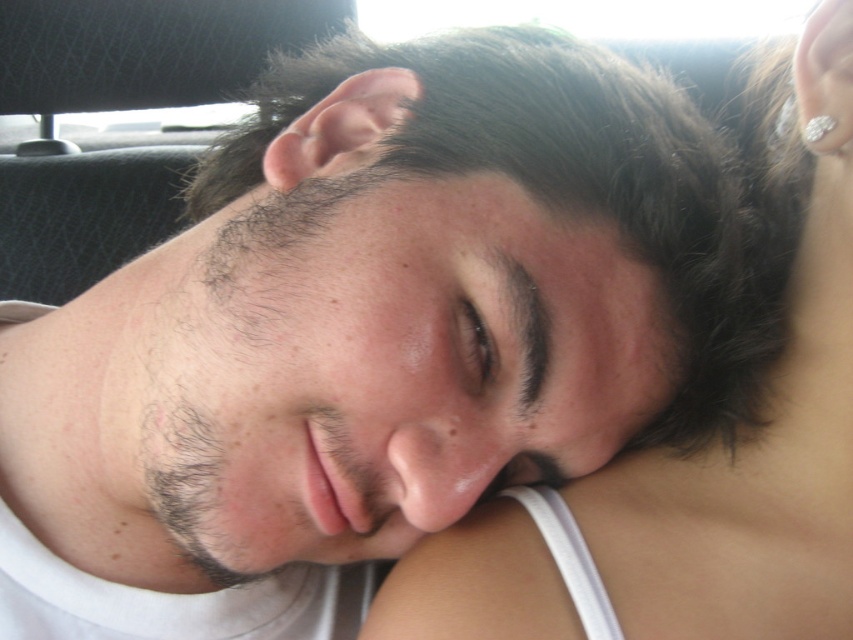
Question: Which of the following is the farthest from the observer?

Choices:
 (A) dark brown hair at center
 (B) white fabric at upper center
 (C) brown matte eye at center

Answer: (B)

Question: Which point is closer to the camera taking this photo?

Choices:
 (A) (x=469, y=308)
 (B) (x=251, y=208)
 (C) (x=376, y=611)

Answer: (A)

Question: Considering the relative positions of dark brown hair at center and white fabric at upper center in the image provided, where is dark brown hair at center located with respect to white fabric at upper center?

Choices:
 (A) left
 (B) right

Answer: (A)

Question: Is dark brown hair at center to the right of brown matte eye at center from the viewer's perspective?

Choices:
 (A) yes
 (B) no

Answer: (B)

Question: Which object is farther from the camera taking this photo?

Choices:
 (A) dark brown hair at center
 (B) white fabric at upper center

Answer: (B)

Question: Does white fabric at upper center appear under brown matte eye at center?

Choices:
 (A) yes
 (B) no

Answer: (A)